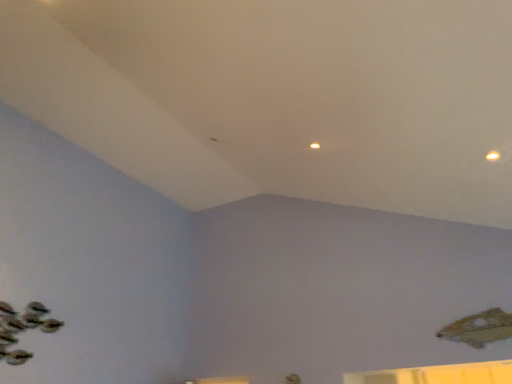
The height and width of the screenshot is (384, 512). What do you see at coordinates (479, 328) in the screenshot?
I see `shiny gold fish at lower right` at bounding box center [479, 328].

At what (x,y) coordinates should I click in order to perform the action: click on shiny gold fish at lower right. Please return your answer as a coordinate pair (x, y). The height and width of the screenshot is (384, 512). Looking at the image, I should click on (479, 328).

What are the coordinates of `shiny gold fish at lower right` in the screenshot? It's located at (479, 328).